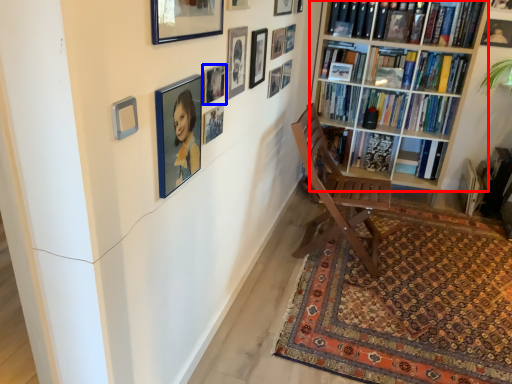
Question: Which of the following is the closest to the observer, bookcase (highlighted by a red box) or picture frame (highlighted by a blue box)?

Choices:
 (A) bookcase
 (B) picture frame

Answer: (B)